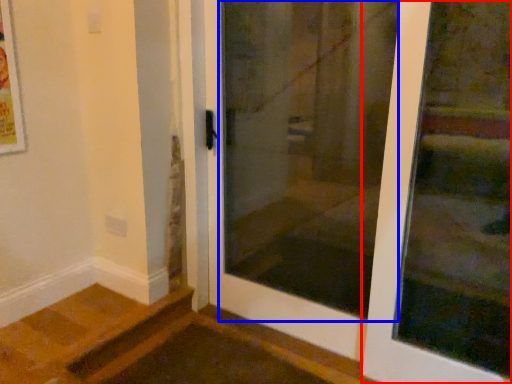
Question: Which of the following is the farthest to the observer, door (highlighted by a red box) or screen door (highlighted by a blue box)?

Choices:
 (A) door
 (B) screen door

Answer: (B)